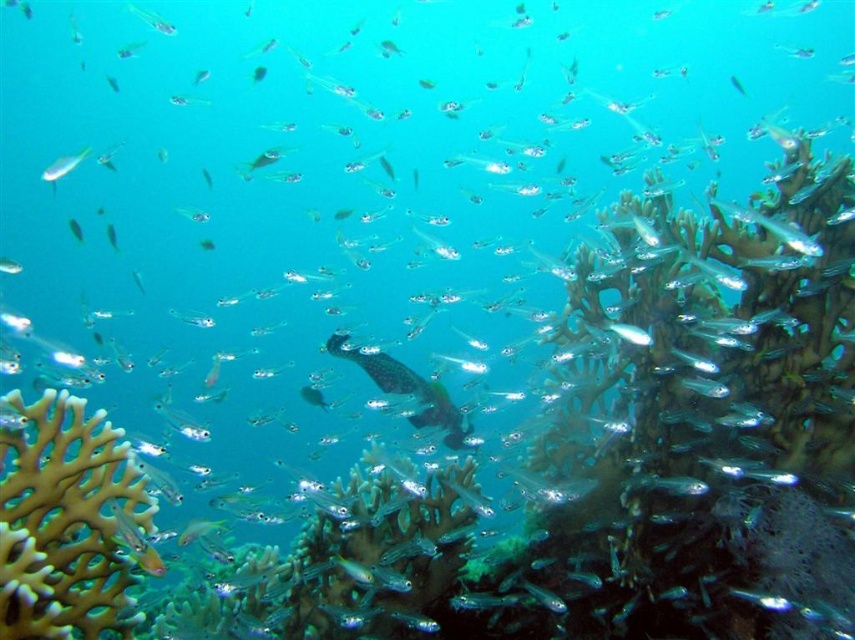
Between brown porous coral at lower left and translucent glass at upper left, which one is positioned lower?

brown porous coral at lower left

Can you confirm if brown porous coral at lower left is positioned above translucent glass at upper left?

No.

Locate an element on the screen. The height and width of the screenshot is (640, 855). brown porous coral at lower left is located at coordinates point(63,522).